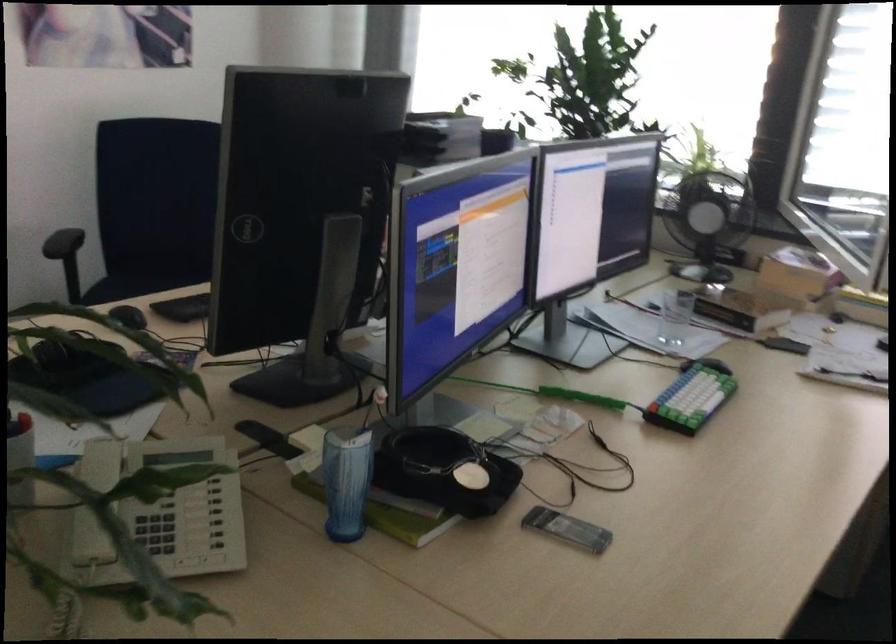
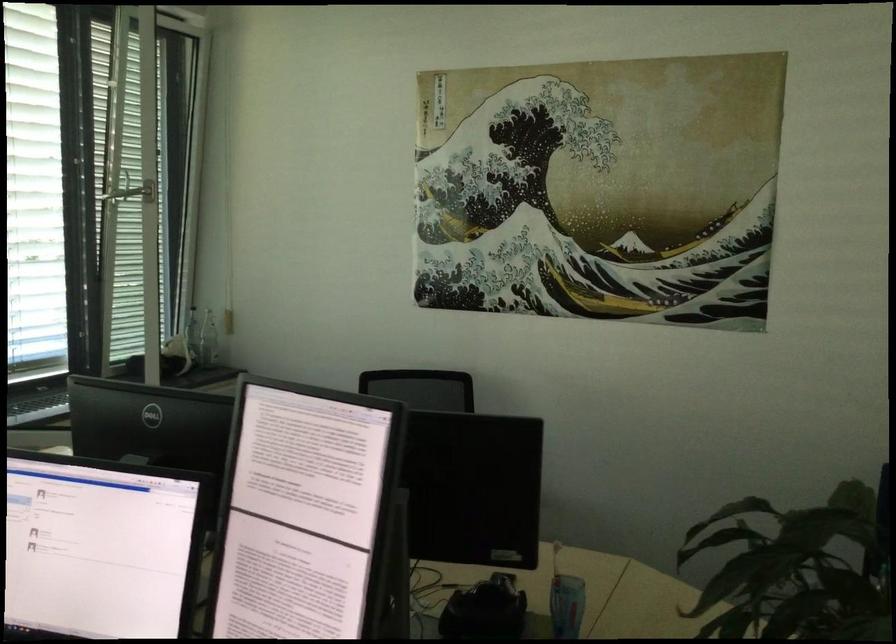
Find the pixel in the second image that matches point (351, 536) in the first image.

(566, 605)